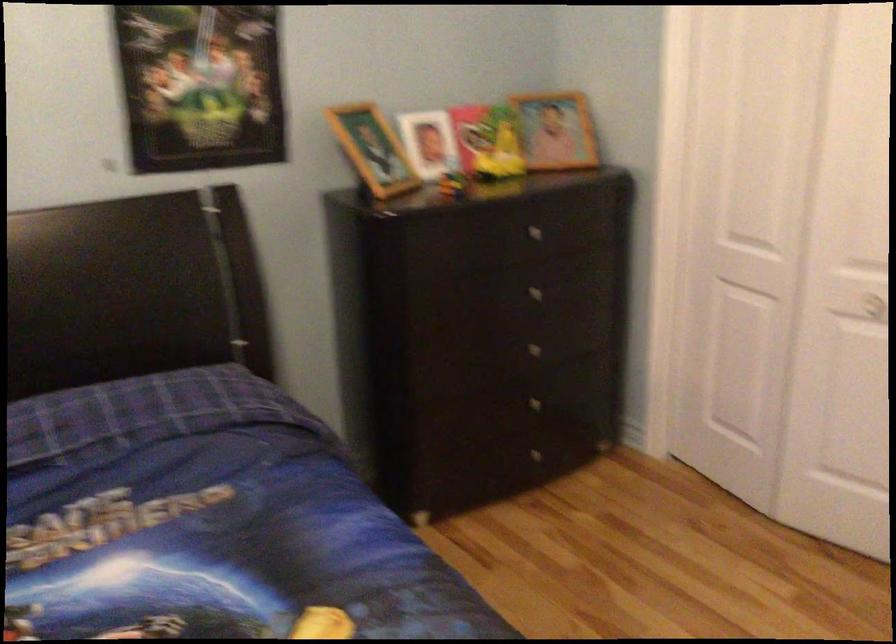
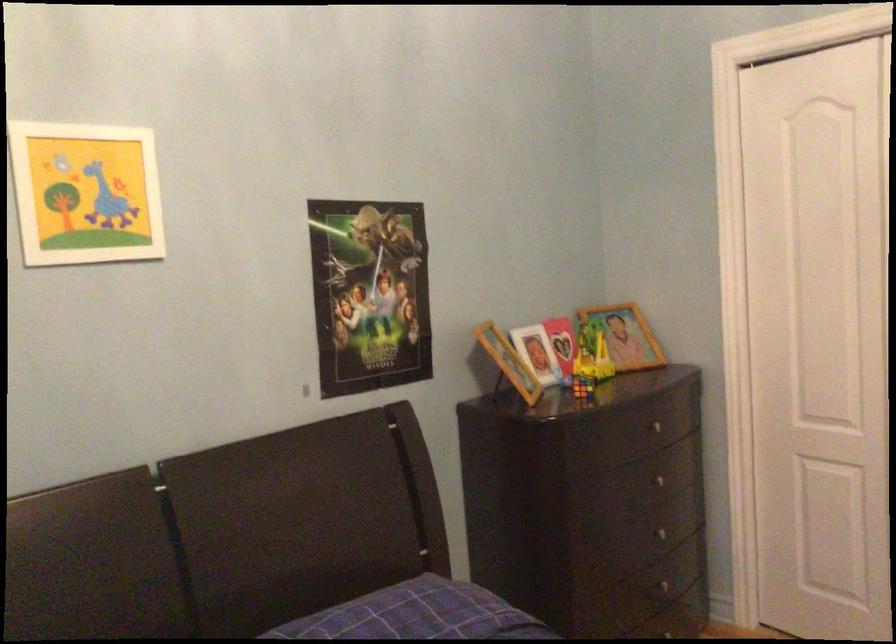
Find the pixel in the second image that matches (535,343) in the first image.

(667, 532)